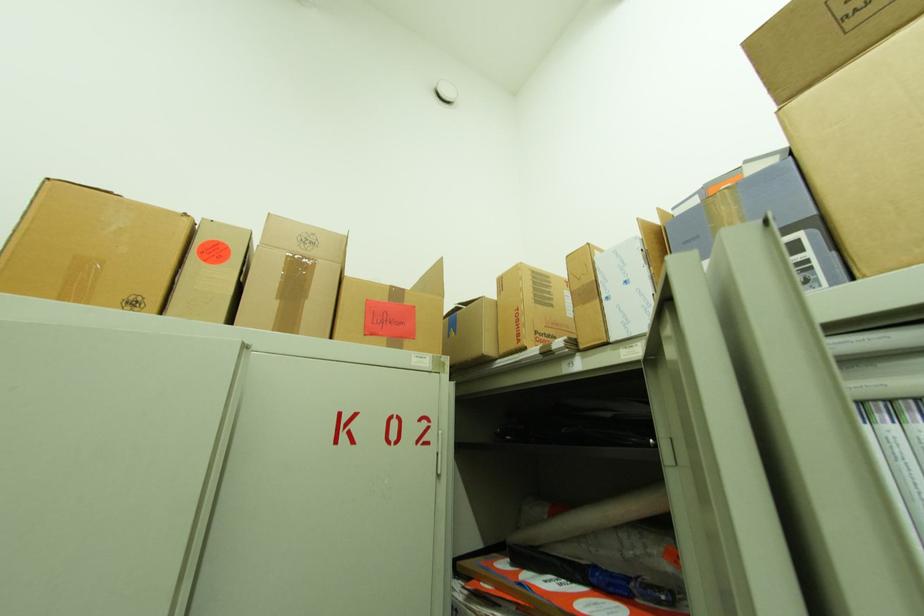
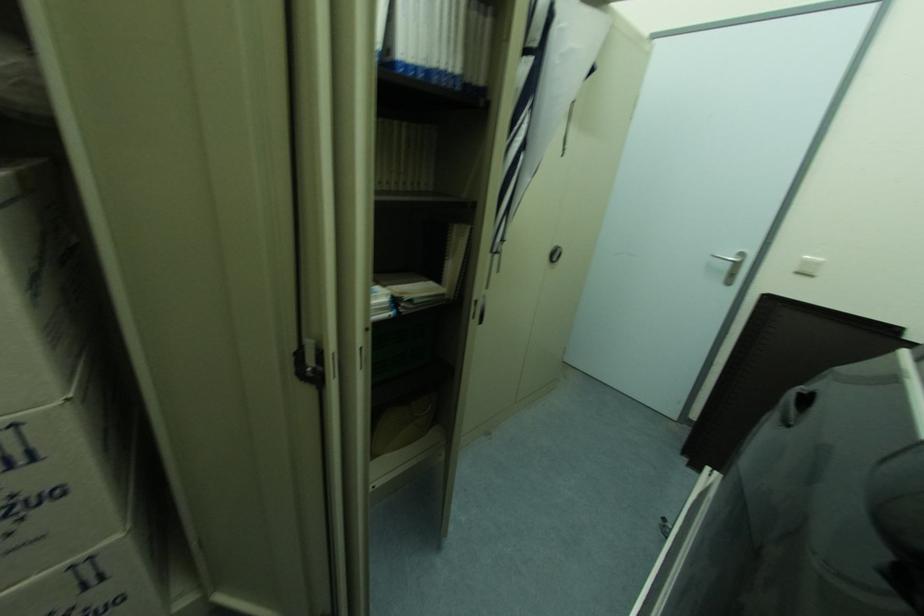
Based on the continuous images, in which direction is the camera rotating?

The rotation direction of the camera is right-down.